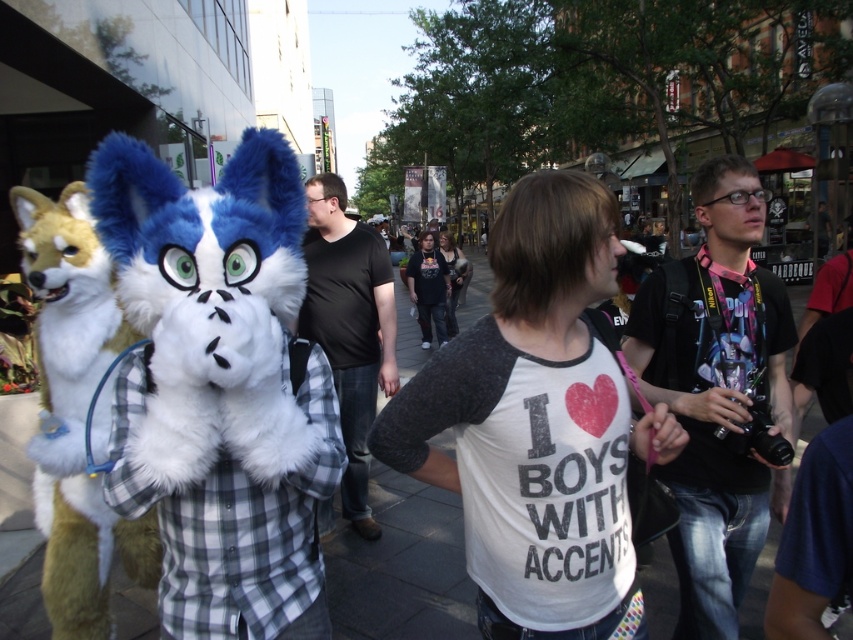
The width and height of the screenshot is (853, 640). What do you see at coordinates (717, 390) in the screenshot? I see `black fabric camera at right` at bounding box center [717, 390].

Who is taller, black fabric camera at right or dark brown leather jacket at center?

black fabric camera at right is taller.

What do you see at coordinates (717, 390) in the screenshot? I see `black fabric camera at right` at bounding box center [717, 390].

Where is `black fabric camera at right`? The width and height of the screenshot is (853, 640). black fabric camera at right is located at coordinates (717, 390).

Is fluffy white fox at left bigger than black matte shirt at center?

No, fluffy white fox at left is not bigger than black matte shirt at center.

Does point (56, 605) lie in front of point (334, 230)?

Yes, it is.

The height and width of the screenshot is (640, 853). Describe the element at coordinates (76, 413) in the screenshot. I see `fluffy white fox at left` at that location.

Find the location of a particular element. fluffy white fox at left is located at coordinates (76, 413).

Is white fur costume at center wider than black matte shirt at center?

In fact, white fur costume at center might be narrower than black matte shirt at center.

Can you confirm if white fur costume at center is smaller than black matte shirt at center?

Yes, white fur costume at center is smaller than black matte shirt at center.

At what (x,y) coordinates should I click in order to perform the action: click on white fur costume at center. Please return your answer as a coordinate pair (x, y). This screenshot has width=853, height=640. Looking at the image, I should click on (219, 388).